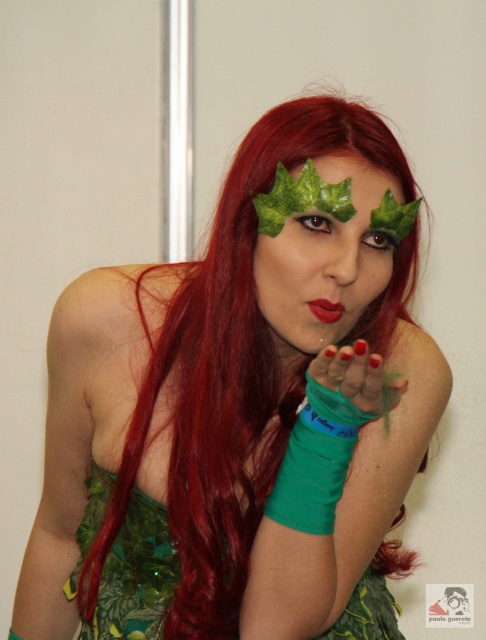
Which is above, green matte leaf at center or green fabric dress at center?

green matte leaf at center is higher up.

Is green matte leaf at center positioned at the back of green fabric dress at center?

No, it is in front of green fabric dress at center.

The image size is (486, 640). Describe the element at coordinates (326, 259) in the screenshot. I see `green matte leaf at center` at that location.

The height and width of the screenshot is (640, 486). I want to click on green matte leaf at center, so click(x=326, y=259).

Is green matte leaf at center thinner than green matte glove at center?

In fact, green matte leaf at center might be wider than green matte glove at center.

Which is more to the right, green matte leaf at center or green matte glove at center?

green matte glove at center

Where is `green matte leaf at center`? Image resolution: width=486 pixels, height=640 pixels. green matte leaf at center is located at coordinates (326, 259).

Does green fabric dress at center have a greater height compared to green matte glove at center?

Correct, green fabric dress at center is much taller as green matte glove at center.

Does point (350, 605) come behind point (349, 365)?

Yes, point (350, 605) is farther from viewer.

Image resolution: width=486 pixels, height=640 pixels. What do you see at coordinates (137, 577) in the screenshot? I see `green fabric dress at center` at bounding box center [137, 577].

Find the location of a particular element. green fabric dress at center is located at coordinates (137, 577).